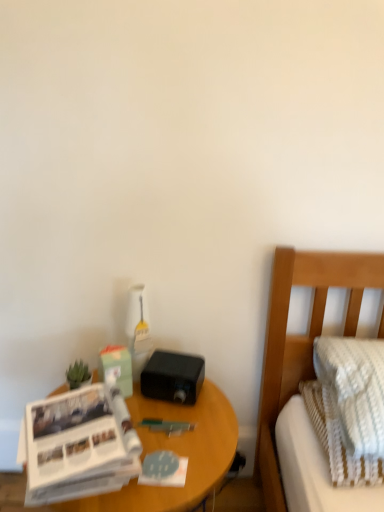
Question: Is wooden nightstand at lower left completely or partially inside green matte plant at left?

Choices:
 (A) no
 (B) yes

Answer: (A)

Question: From a real-world perspective, is green matte plant at left physically below wooden nightstand at lower left?

Choices:
 (A) no
 (B) yes

Answer: (A)

Question: Does green matte plant at left appear on the right side of wooden nightstand at lower left?

Choices:
 (A) no
 (B) yes

Answer: (A)

Question: Is green matte plant at left shorter than wooden nightstand at lower left?

Choices:
 (A) no
 (B) yes

Answer: (B)

Question: Is green matte plant at left smaller than wooden nightstand at lower left?

Choices:
 (A) yes
 (B) no

Answer: (A)

Question: Considering the positions of wooden nightstand at lower left and white paper at left in the image, is wooden nightstand at lower left wider or thinner than white paper at left?

Choices:
 (A) wide
 (B) thin

Answer: (A)

Question: From a real-world perspective, is wooden nightstand at lower left above or below white paper at left?

Choices:
 (A) below
 (B) above

Answer: (A)

Question: In terms of height, does wooden nightstand at lower left look taller or shorter compared to white paper at left?

Choices:
 (A) short
 (B) tall

Answer: (B)

Question: From the image's perspective, is wooden nightstand at lower left above or below white paper at left?

Choices:
 (A) above
 (B) below

Answer: (B)

Question: From the image's perspective, is green matte plant at left located above or below wooden nightstand at lower left?

Choices:
 (A) above
 (B) below

Answer: (A)

Question: Is green matte plant at left to the left or to the right of wooden nightstand at lower left in the image?

Choices:
 (A) right
 (B) left

Answer: (B)

Question: In terms of size, does green matte plant at left appear bigger or smaller than wooden nightstand at lower left?

Choices:
 (A) big
 (B) small

Answer: (B)

Question: From a real-world perspective, relative to wooden nightstand at lower left, is green matte plant at left vertically above or below?

Choices:
 (A) below
 (B) above

Answer: (B)

Question: In terms of size, does white textured mattress at right appear bigger or smaller than green matte plant at left?

Choices:
 (A) small
 (B) big

Answer: (B)

Question: From the image's perspective, is white textured mattress at right located above or below green matte plant at left?

Choices:
 (A) below
 (B) above

Answer: (A)